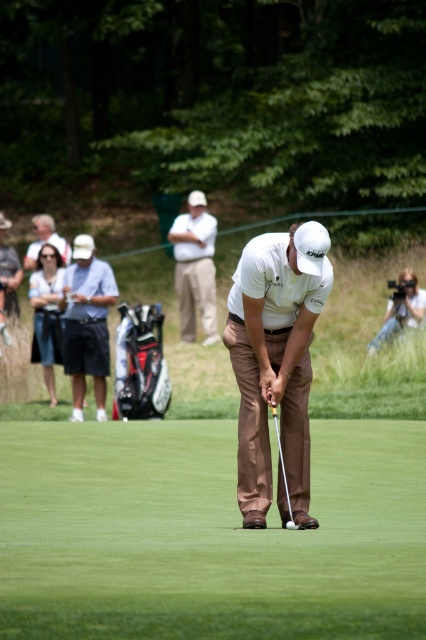
You are a photographer at the golf course and need to position yourself so that both the dark blue cotton shorts at left and the matte white camera at right are visible in your shot. Based on their positions, which object should you focus on first to ensure both are in frame?

The dark blue cotton shorts at left is located below the matte white camera at right. To ensure both are in frame, focus on the matte white camera at right first as it is higher up, allowing the lower positioned shorts to still be captured within the shot.

You are a golfer preparing to putt the ball. You notice two points marked on the green. The first point is at coordinates point (17, 312), and the second is at point (48, 237). Which point is closer to your current position?

Point (17, 312) is in front of point (48, 237), so it is closer to your current position.

You are standing on the golf course and see the point marked as point (91, 237). If you want to throw a small pebble to hit the ball that the golfer is about to put, will you be able to reach it without moving closer?

The point (91, 237) is 66.12 feet away from you, so you can throw the pebble to reach it without needing to move closer.